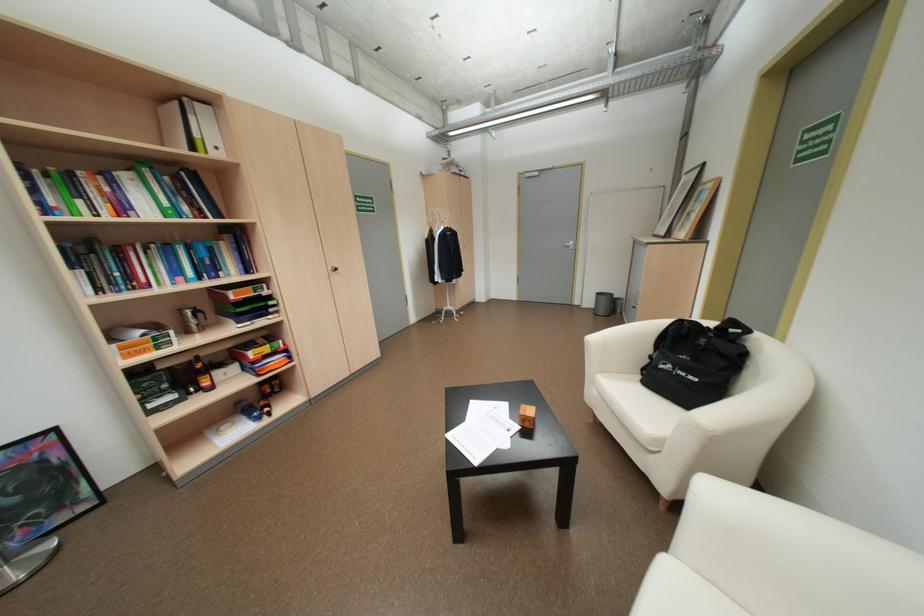
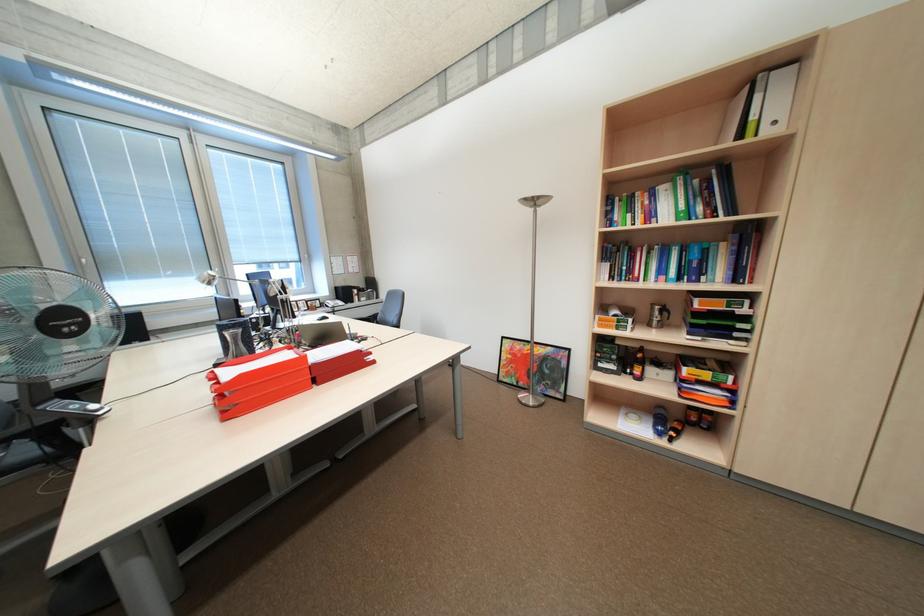
Find the pixel in the second image that matches the point at 190,310 in the first image.

(663, 304)